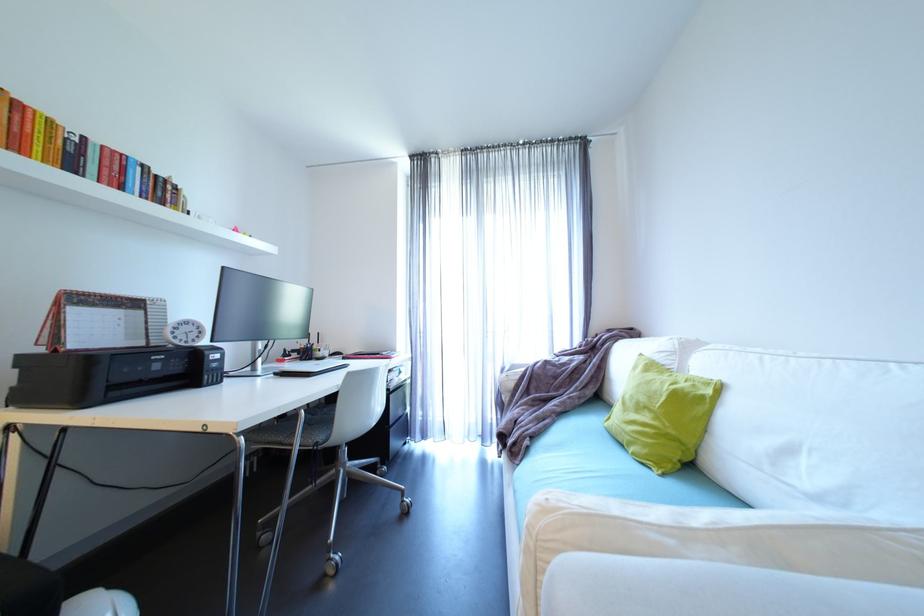
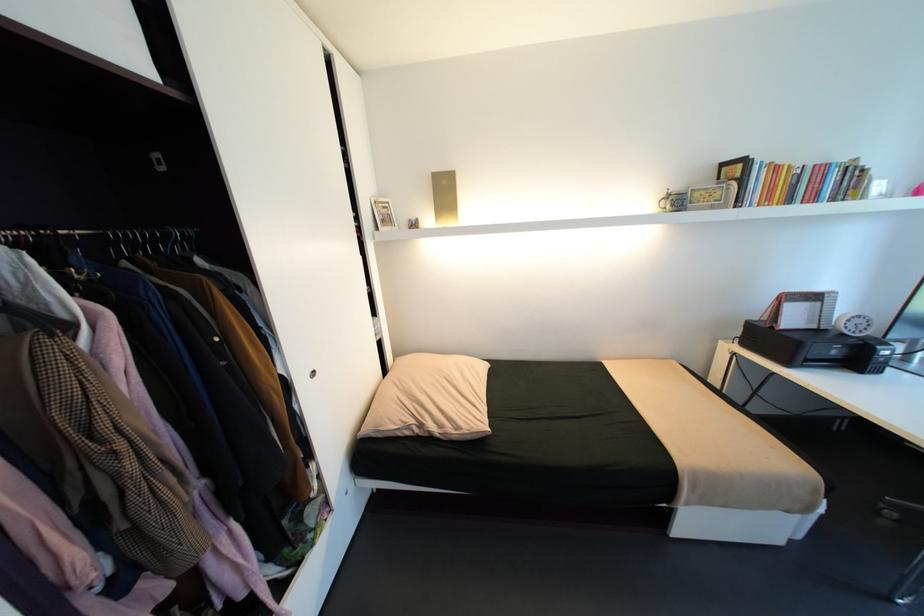
In the second image, find the point that corresponds to (111,147) in the first image.

(821, 166)